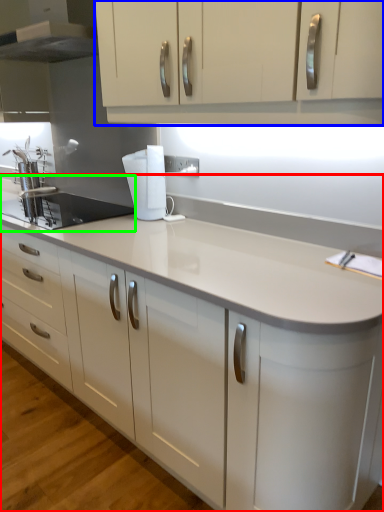
Question: Which object is positioned closest to countertop (highlighted by a red box)? Select from cabinetry (highlighted by a blue box) and sink (highlighted by a green box).

Choices:
 (A) cabinetry
 (B) sink

Answer: (A)